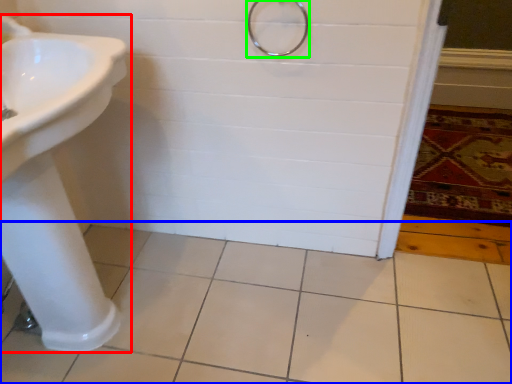
Question: Considering the real-world distances, which object is farthest from sink (highlighted by a red box)? ceramic tile (highlighted by a blue box) or shower (highlighted by a green box)?

Choices:
 (A) ceramic tile
 (B) shower

Answer: (B)